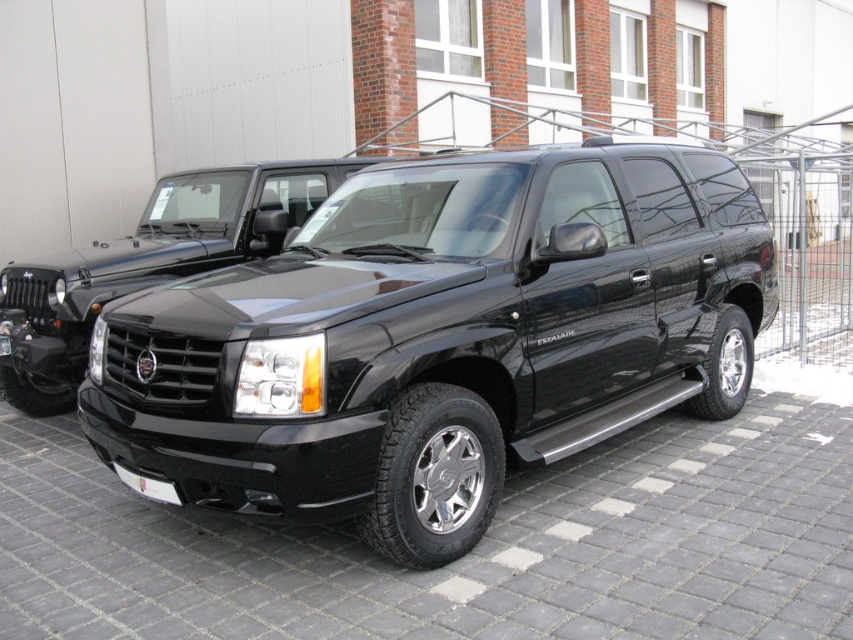
Question: In this image, where is glossy black suv at center located relative to white plastic license plate at lower center?

Choices:
 (A) below
 (B) above

Answer: (B)

Question: Which object is closer to the camera taking this photo?

Choices:
 (A) white plastic license plate at center
 (B) white plastic license plate at lower center
 (C) glossy black suv at center

Answer: (C)

Question: Does white plastic license plate at lower center appear on the left side of white plastic license plate at center?

Choices:
 (A) no
 (B) yes

Answer: (A)

Question: Does white plastic license plate at lower center have a smaller size compared to white plastic license plate at center?

Choices:
 (A) yes
 (B) no

Answer: (B)

Question: Which of the following is the closest to the observer?

Choices:
 (A) (171, 497)
 (B) (3, 333)

Answer: (A)

Question: Among these objects, which one is nearest to the camera?

Choices:
 (A) white plastic license plate at lower center
 (B) glossy black suv at center

Answer: (B)